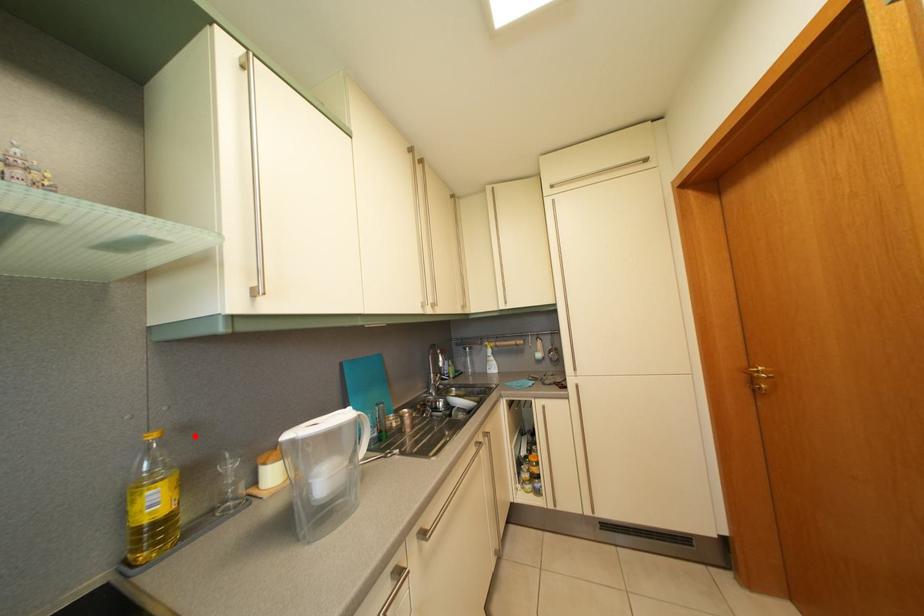
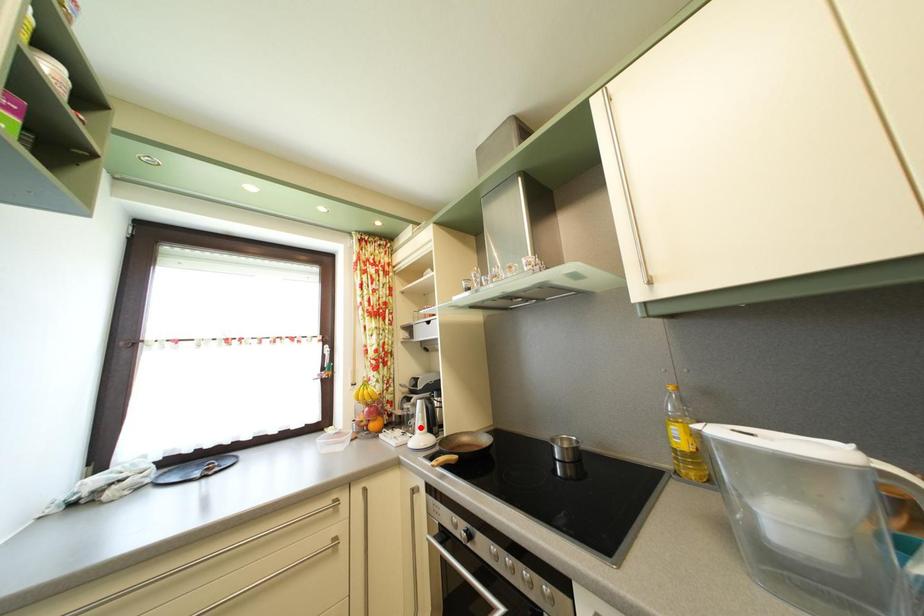
Consider the image. I am providing you with two images of the same scene from different viewpoints. A red point is marked on the first image and another point is marked on the second image. Is the red point in image1 aligned with the point shown in image2?

No